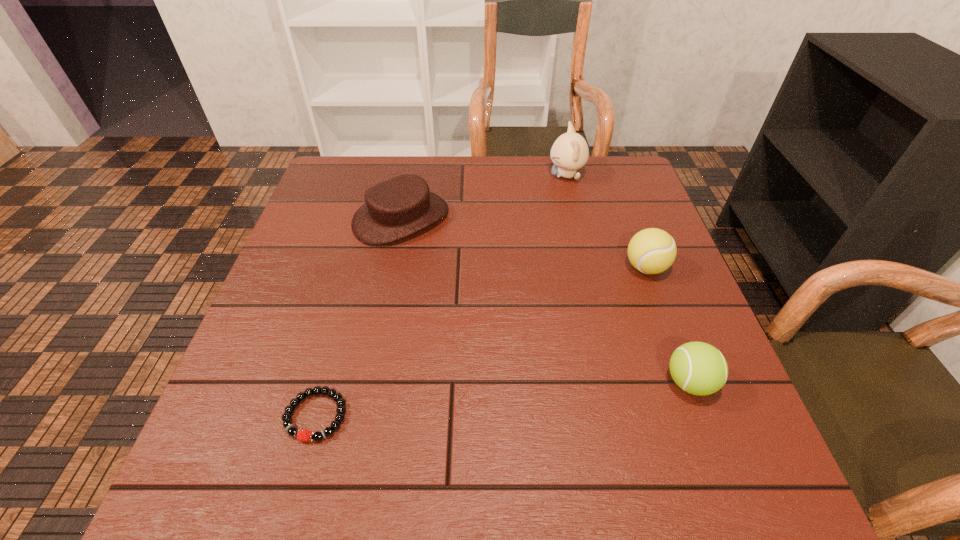
This screenshot has width=960, height=540. I want to click on vacant space at the far edge of the desktop, so click(x=537, y=167).

Where is `vacant space at the near edge`? vacant space at the near edge is located at coordinates (485, 489).

This screenshot has height=540, width=960. I want to click on vacant space at the left edge, so pos(257,367).

Find the location of a particular element. The height and width of the screenshot is (540, 960). vacant position at the right edge of the desktop is located at coordinates (674, 296).

Identify the location of free space at the far left corner. (364, 176).

Image resolution: width=960 pixels, height=540 pixels. In the image, there is a desktop. Identify the location of vacant space at the near right corner. (683, 477).

The height and width of the screenshot is (540, 960). Find the location of `vacant space in between the third object from left to right and the hat`. vacant space in between the third object from left to right and the hat is located at coordinates (484, 197).

Locate an element on the screen. vacant area between the third farthest object and the farthest object is located at coordinates click(x=606, y=221).

This screenshot has width=960, height=540. Find the location of `empty space between the bracelet and the nearer tennis ball`. empty space between the bracelet and the nearer tennis ball is located at coordinates (503, 399).

Identify the location of free area in between the tallest object and the hat. pos(484,197).